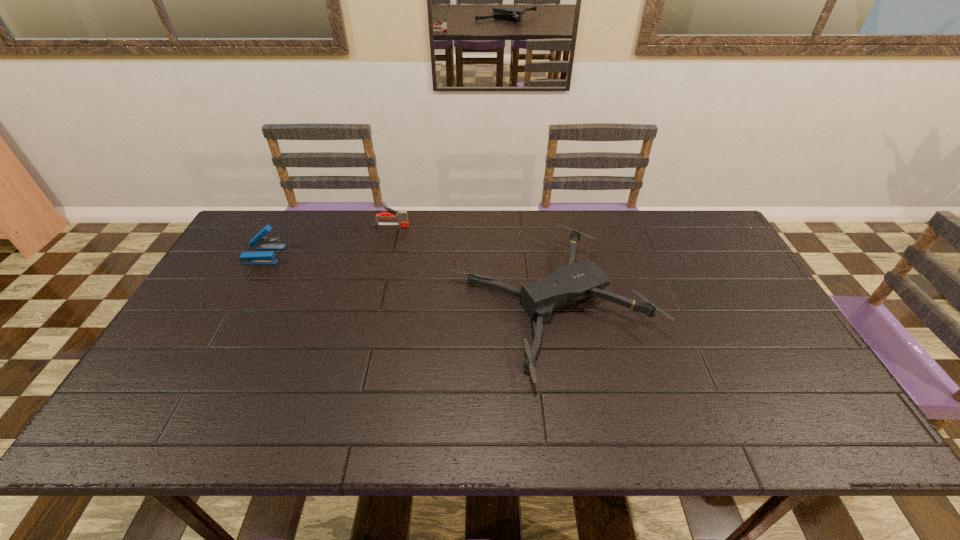
Find the location of a particular element. The width and height of the screenshot is (960, 540). the right stapler is located at coordinates (402, 216).

Locate an element on the screen. This screenshot has height=540, width=960. the farthest object is located at coordinates (402, 216).

Identify the location of the nearer stapler. (258, 242).

This screenshot has height=540, width=960. In order to click on the shorter stapler in this screenshot , I will do `click(258, 242)`.

Find the location of a particular element. drone is located at coordinates (576, 281).

Where is `vacant region located 0.300m on the handle side of the right stapler`? The height and width of the screenshot is (540, 960). vacant region located 0.300m on the handle side of the right stapler is located at coordinates (496, 225).

The image size is (960, 540). In order to click on vacant space situated on the back of the leftmost object in this screenshot , I will do `click(287, 215)`.

The height and width of the screenshot is (540, 960). Identify the location of vacant space located 0.180m on the right of the drone. (717, 306).

You are a GUI agent. You are given a task and a screenshot of the screen. Output one action in this format:
    pyautogui.click(x=<x>, y=<y>)
    Task: Click on the drone present at the far edge
    Image resolution: width=960 pixels, height=540 pixels.
    Given the screenshot: What is the action you would take?
    pyautogui.click(x=576, y=281)

Where is `object present at the left edge`? This screenshot has width=960, height=540. object present at the left edge is located at coordinates (258, 242).